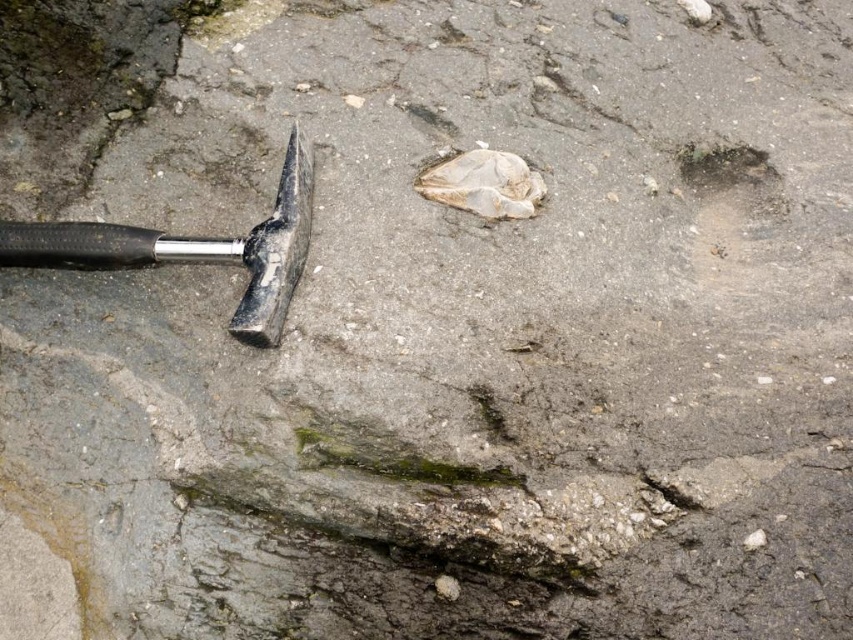
Question: Observing the image, what is the correct spatial positioning of matte black hammer at left in reference to smooth gray hole at upper right?

Choices:
 (A) left
 (B) right

Answer: (A)

Question: Which point appears farthest from the camera in this image?

Choices:
 (A) (280, 269)
 (B) (734, 180)

Answer: (B)

Question: Which object appears farthest from the camera in this image?

Choices:
 (A) smooth gray hole at upper right
 (B) matte black hammer at left

Answer: (A)

Question: Which point is farther to the camera?

Choices:
 (A) pyautogui.click(x=700, y=161)
 (B) pyautogui.click(x=113, y=243)

Answer: (A)

Question: In this image, where is matte black hammer at left located relative to smooth gray hole at upper right?

Choices:
 (A) below
 (B) above

Answer: (A)

Question: Considering the relative positions of matte black hammer at left and smooth gray hole at upper right in the image provided, where is matte black hammer at left located with respect to smooth gray hole at upper right?

Choices:
 (A) right
 (B) left

Answer: (B)